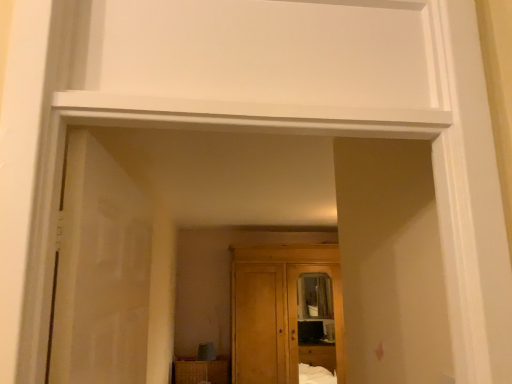
Question: Can you confirm if translucent glass door at left is shorter than wooden cabinet at lower center?

Choices:
 (A) no
 (B) yes

Answer: (A)

Question: Is translucent glass door at left smaller than wooden cabinet at lower center?

Choices:
 (A) yes
 (B) no

Answer: (A)

Question: Is translucent glass door at left positioned behind wooden cabinet at lower center?

Choices:
 (A) no
 (B) yes

Answer: (A)

Question: Is the surface of translucent glass door at left in direct contact with wooden cabinet at lower center?

Choices:
 (A) no
 (B) yes

Answer: (A)

Question: From a real-world perspective, is translucent glass door at left positioned over wooden cabinet at lower center based on gravity?

Choices:
 (A) yes
 (B) no

Answer: (A)

Question: In terms of width, does translucent glass door at left look wider or thinner when compared to wooden cabinet at lower center?

Choices:
 (A) thin
 (B) wide

Answer: (A)

Question: From the image's perspective, is translucent glass door at left above or below wooden cabinet at lower center?

Choices:
 (A) above
 (B) below

Answer: (A)

Question: Choose the correct answer: Is translucent glass door at left inside wooden cabinet at lower center or outside it?

Choices:
 (A) outside
 (B) inside

Answer: (A)

Question: Looking at the image, does translucent glass door at left seem bigger or smaller compared to wooden cabinet at lower center?

Choices:
 (A) small
 (B) big

Answer: (A)

Question: From their relative heights in the image, would you say wooden cupboard at center is taller or shorter than translucent glass door at left?

Choices:
 (A) short
 (B) tall

Answer: (B)

Question: Is wooden cupboard at center wider or thinner than translucent glass door at left?

Choices:
 (A) thin
 (B) wide

Answer: (B)

Question: Would you say wooden cupboard at center is to the left or to the right of translucent glass door at left in the picture?

Choices:
 (A) right
 (B) left

Answer: (A)

Question: From a real-world perspective, is wooden cupboard at center positioned above or below translucent glass door at left?

Choices:
 (A) below
 (B) above

Answer: (A)

Question: From a real-world perspective, is wooden cabinet at lower center above or below wooden cupboard at center?

Choices:
 (A) below
 (B) above

Answer: (A)

Question: In the image, is wooden cabinet at lower center positioned in front of or behind wooden cupboard at center?

Choices:
 (A) front
 (B) behind

Answer: (B)